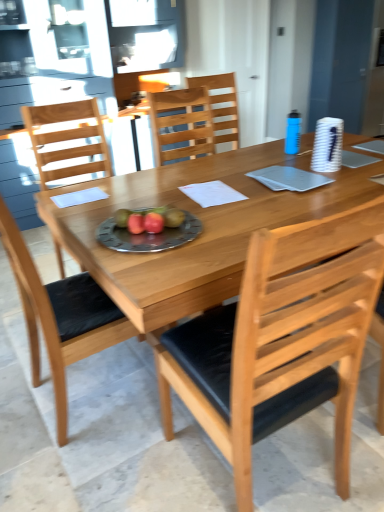
Identify the location of free point above natural wood table at center (from a real-world perspective). The width and height of the screenshot is (384, 512). (252, 184).